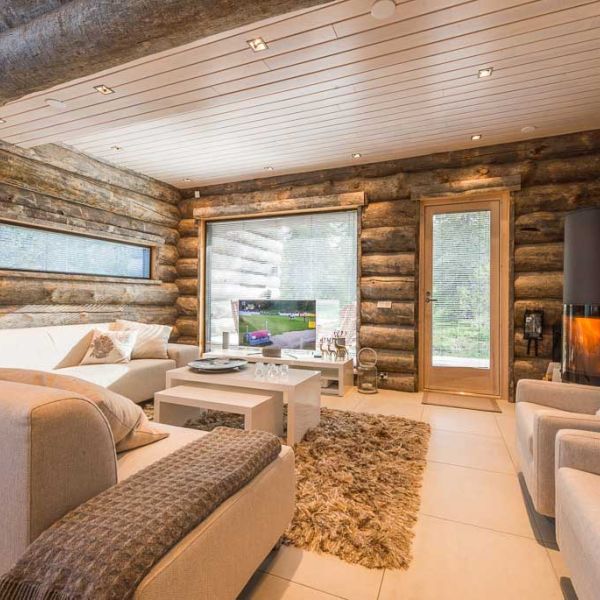
I want to click on 7 visible recessed lights, so point(114,149), point(253,47), point(186,181), point(268,166), point(355,153), point(474,137), point(484,72).